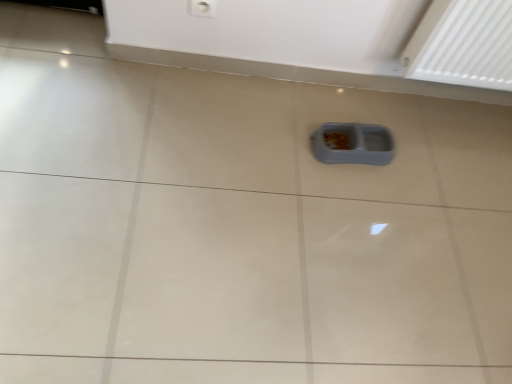
At what (x,y) coordinates should I click in order to perform the action: click on free region on the left part of gray plastic food container at center. Please return your answer as a coordinate pair (x, y). This screenshot has width=512, height=384. Looking at the image, I should click on (286, 127).